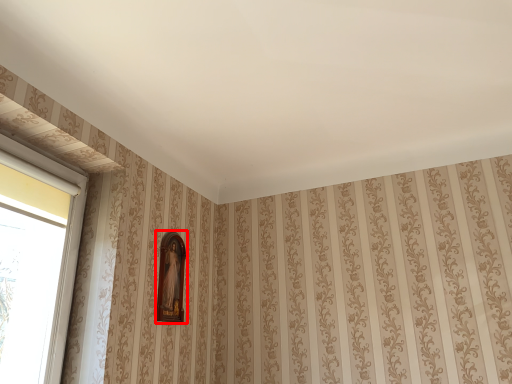
Question: Observing the image, what is the correct spatial positioning of picture frame (annotated by the red box) in reference to window?

Choices:
 (A) right
 (B) left

Answer: (A)